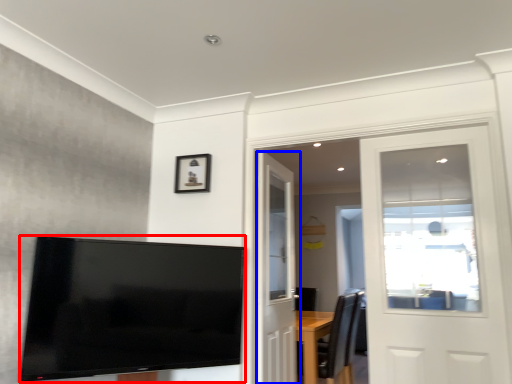
Question: Which point is closer to the camera, television (highlighted by a red box) or door (highlighted by a blue box)?

Choices:
 (A) television
 (B) door

Answer: (A)